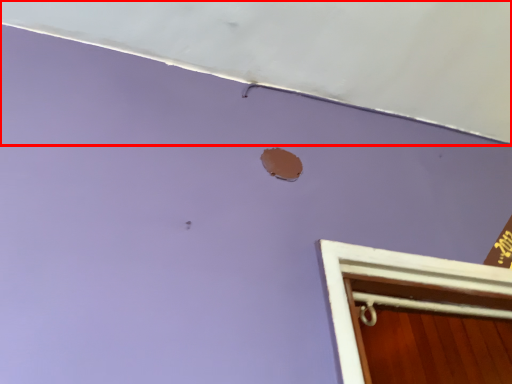
Question: Observing the image, what is the correct spatial positioning of exhaust hood (annotated by the red box) in reference to hole?

Choices:
 (A) right
 (B) left

Answer: (A)